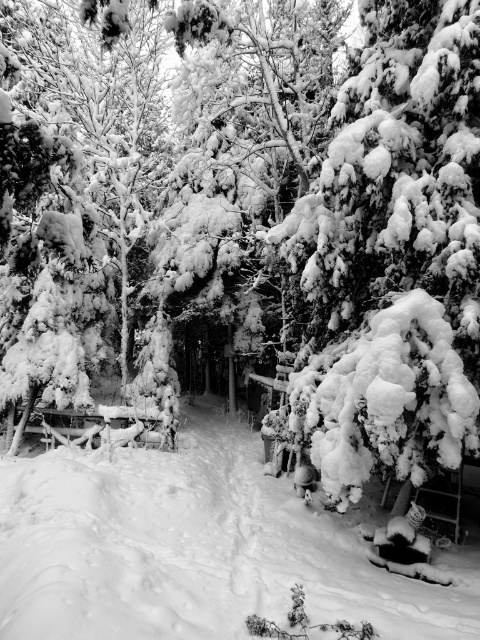
Can you confirm if snow-covered evergreen at right is positioned above white fluffy snow at center?

Yes.

Does snow-covered evergreen at right have a larger size compared to white fluffy snow at center?

No.

This screenshot has width=480, height=640. I want to click on snow-covered evergreen at right, so click(396, 248).

Locate an element on the screen. The height and width of the screenshot is (640, 480). snow-covered evergreen at right is located at coordinates (x=396, y=248).